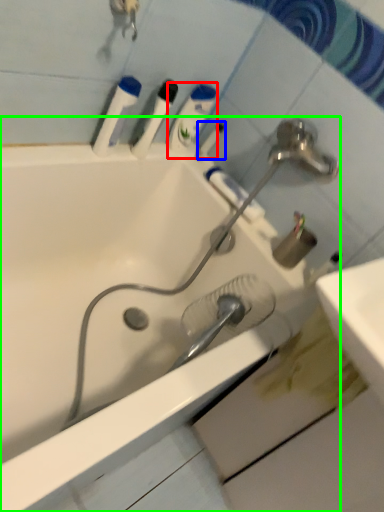
Question: Which object is the closest to the mouthwash (highlighted by a red box)? Choose among these: toothbrush (highlighted by a blue box) or bathtub (highlighted by a green box).

Choices:
 (A) toothbrush
 (B) bathtub

Answer: (A)